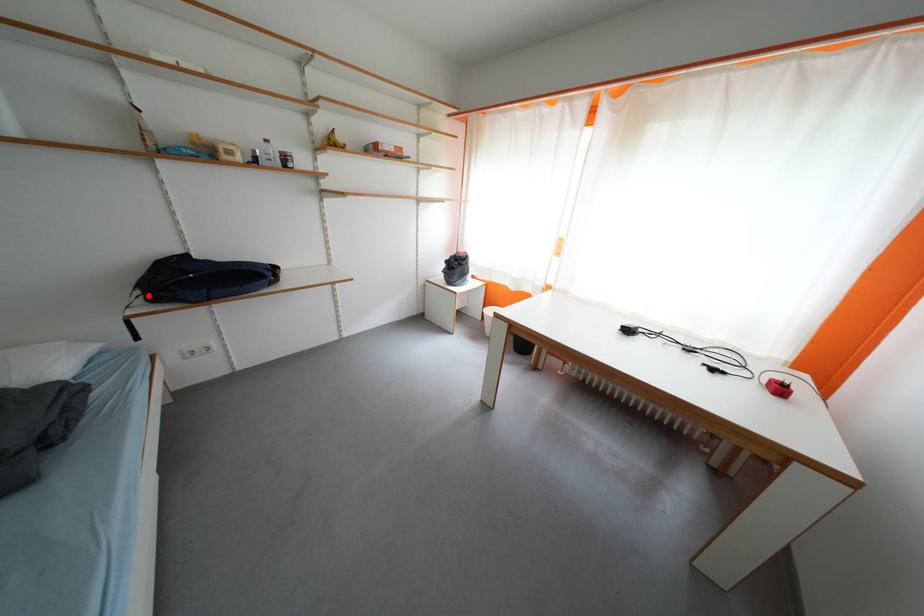
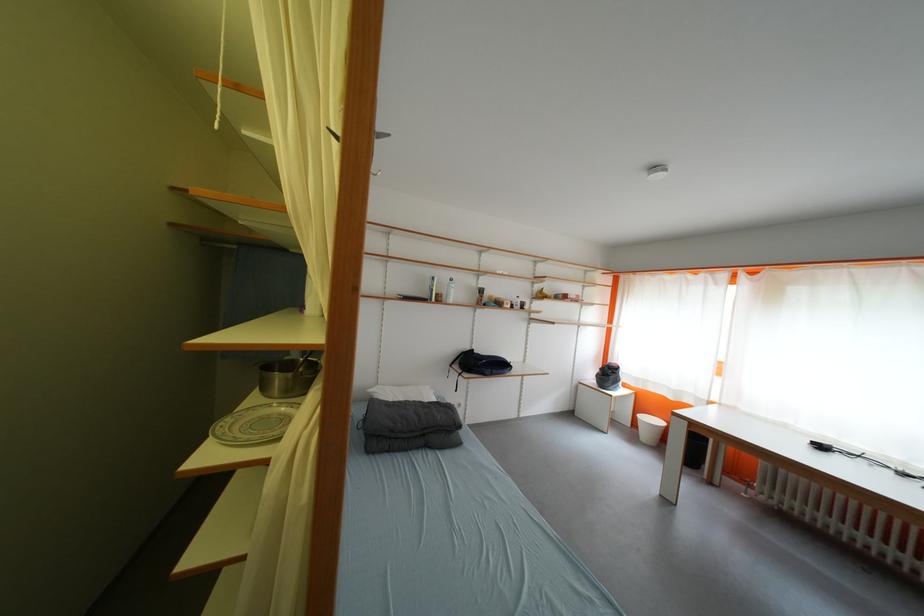
Question: I am providing you with two images of the same scene from different viewpoints. A red point is marked on the first image. At the location where the point appears in image 1, is it still visible in image 2?

Choices:
 (A) Yes
 (B) No

Answer: (A)